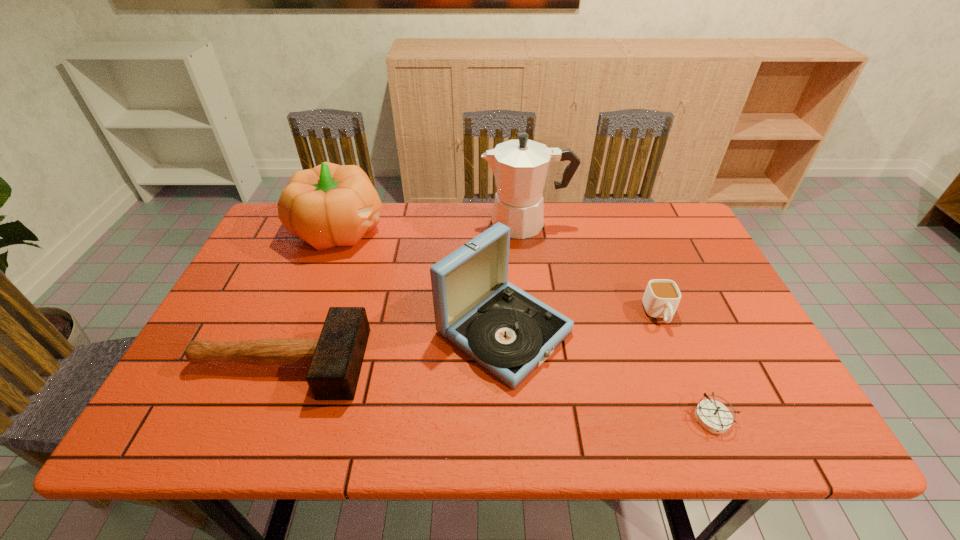
You are a GUI agent. You are given a task and a screenshot of the screen. Output one action in this format:
    pyautogui.click(x=<x>, y=<y>)
    Task: Click on the coffeepot
    The image size is (960, 540).
    Given the screenshot: What is the action you would take?
    pyautogui.click(x=520, y=167)

This screenshot has height=540, width=960. I want to click on pumpkin, so click(330, 205).

Find the location of a particular element. Image resolution: width=960 pixels, height=540 pixels. phonograph record is located at coordinates (510, 333).

Image resolution: width=960 pixels, height=540 pixels. In order to click on mallet in this screenshot , I will do `click(335, 359)`.

Locate an element on the screen. The height and width of the screenshot is (540, 960). cup is located at coordinates (x=661, y=298).

Locate an element on the screen. compass is located at coordinates (713, 416).

Find the location of `vacant space located at the spout of the coffeepot`. vacant space located at the spout of the coffeepot is located at coordinates pyautogui.click(x=421, y=224).

The height and width of the screenshot is (540, 960). Identify the location of vacant space situated at the spout of the coffeepot. (383, 224).

Where is `vacant space situated at the spout of the coffeepot`? Image resolution: width=960 pixels, height=540 pixels. vacant space situated at the spout of the coffeepot is located at coordinates (466, 224).

Where is `vacant point located on the carved face of the pumpkin`? This screenshot has height=540, width=960. vacant point located on the carved face of the pumpkin is located at coordinates (409, 230).